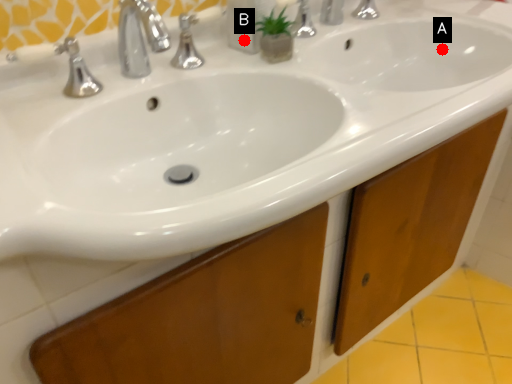
Question: Two points are circled on the image, labeled by A and B beside each circle. Which point is closer to the camera?

Choices:
 (A) A is closer
 (B) B is closer

Answer: (B)